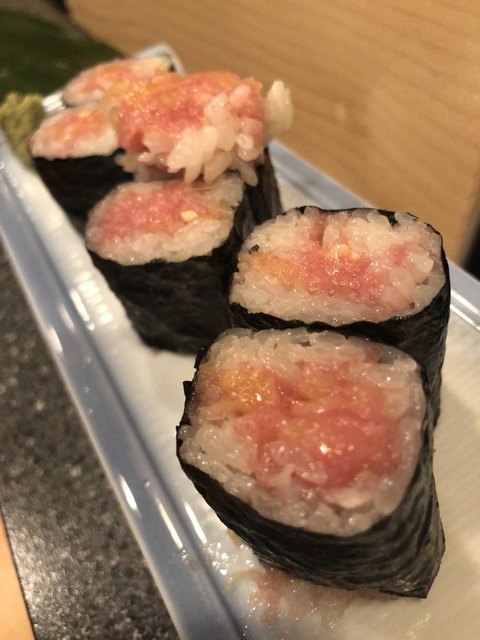
What are the coordinates of `inside plate` in the screenshot? It's located at (451, 450), (178, 360), (284, 195).